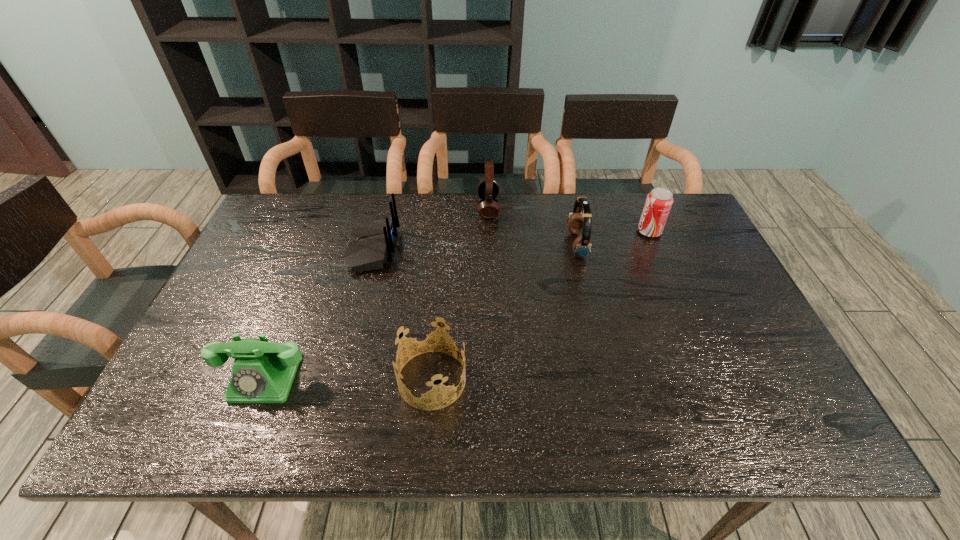
This screenshot has width=960, height=540. Identify the location of vacant space located 0.120m on the ear pads of the farther headset. (442, 208).

Where is `free region located 0.130m on the ear cup of the right headset`? Image resolution: width=960 pixels, height=540 pixels. free region located 0.130m on the ear cup of the right headset is located at coordinates (526, 245).

Image resolution: width=960 pixels, height=540 pixels. In order to click on vacant space situated 0.340m on the ear cup of the right headset in this screenshot , I will do `click(457, 245)`.

The width and height of the screenshot is (960, 540). Identify the location of vacant space situated 0.130m on the ear cup of the right headset. (526, 245).

You are a GUI agent. You are given a task and a screenshot of the screen. Output one action in this format:
    pyautogui.click(x=<x>, y=<y>)
    Task: Click on the vacant space located 0.150m on the logo side of the soda can
    This screenshot has height=540, width=960.
    Given the screenshot: What is the action you would take?
    pyautogui.click(x=589, y=232)

In order to click on vacant region located 0.360m on the logo side of the soda can in this screenshot , I will do pyautogui.click(x=523, y=232).

Where is `free location located on the logo side of the soda can`? Image resolution: width=960 pixels, height=540 pixels. free location located on the logo side of the soda can is located at coordinates [x=609, y=232].

What are the coordinates of `vacant space located on the back of the router` in the screenshot? It's located at point(506,248).

Locate an element on the screen. This screenshot has height=540, width=960. free space located on the dial of the telephone is located at coordinates (239, 444).

At what (x,y) coordinates should I click in order to perform the action: click on free space located 0.260m on the back of the fourth object from right to left. Please return your answer as a coordinate pair (x, y). Image resolution: width=960 pixels, height=540 pixels. Looking at the image, I should click on (442, 276).